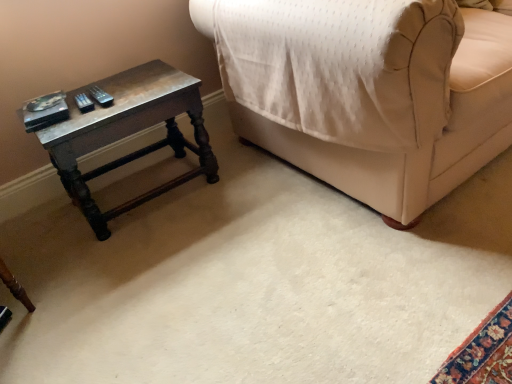
Identify the location of wooden table at left. This screenshot has width=512, height=384. (128, 133).

This screenshot has width=512, height=384. Describe the element at coordinates (128, 133) in the screenshot. I see `wooden table at left` at that location.

This screenshot has width=512, height=384. I want to click on beige fabric couch at upper right, so click(422, 144).

This screenshot has width=512, height=384. What do you see at coordinates (422, 144) in the screenshot? I see `beige fabric couch at upper right` at bounding box center [422, 144].

You are a GUI agent. You are given a task and a screenshot of the screen. Output one action in this format:
    pyautogui.click(x=<x>, y=<y>)
    Task: Click on the wooden table at left
    
    Given the screenshot: What is the action you would take?
    pyautogui.click(x=128, y=133)

Based on the photo, is beige fabric couch at upper right to the right of wooden table at left from the viewer's perspective?

Indeed, beige fabric couch at upper right is positioned on the right side of wooden table at left.

Is beige fabric couch at upper right in front of wooden table at left?

Yes, the depth of beige fabric couch at upper right is less than that of wooden table at left.

Considering the positions of points (459, 166) and (170, 180), is point (459, 166) closer to camera compared to point (170, 180)?

Yes.

From the image's perspective, is beige fabric couch at upper right above or below wooden table at left?

From the image's perspective, beige fabric couch at upper right appears above wooden table at left.

From a real-world perspective, which object stands above the other?

From a 3D spatial view, beige fabric couch at upper right is above.

Considering the sizes of beige fabric couch at upper right and wooden table at left in the image, is beige fabric couch at upper right wider or thinner than wooden table at left?

In the image, beige fabric couch at upper right appears to be wider than wooden table at left.

Who is shorter, beige fabric couch at upper right or wooden table at left?

With less height is wooden table at left.

Which of these two, beige fabric couch at upper right or wooden table at left, is smaller?

wooden table at left.

Is beige fabric couch at upper right not within wooden table at left?

Indeed, beige fabric couch at upper right is completely outside wooden table at left.

Are beige fabric couch at upper right and wooden table at left located far from each other?

beige fabric couch at upper right is actually quite close to wooden table at left.

Is wooden table at left at the back of beige fabric couch at upper right?

That's not correct — beige fabric couch at upper right is not looking away from wooden table at left.

This screenshot has width=512, height=384. I want to click on table that appears below the beige fabric couch at upper right (from a real-world perspective), so click(x=128, y=133).

Which object is positioned more to the left, wooden table at left or beige fabric couch at upper right?

wooden table at left.

In the image, is wooden table at left positioned in front of or behind beige fabric couch at upper right?

Clearly, wooden table at left is behind beige fabric couch at upper right.

Does point (98, 233) lie in front of point (278, 133)?

Yes, it is.

From the image's perspective, is wooden table at left located above beige fabric couch at upper right?

No.

From a real-world perspective, who is located lower, wooden table at left or beige fabric couch at upper right?

wooden table at left is physically lower.

Can you confirm if wooden table at left is wider than beige fabric couch at upper right?

No.

In the scene shown: Considering the sizes of wooden table at left and beige fabric couch at upper right in the image, is wooden table at left taller or shorter than beige fabric couch at upper right?

Clearly, wooden table at left is shorter compared to beige fabric couch at upper right.

Looking at this image, is wooden table at left bigger than beige fabric couch at upper right?

Incorrect, wooden table at left is not larger than beige fabric couch at upper right.

Which is correct: wooden table at left is inside beige fabric couch at upper right, or outside of it?

wooden table at left exists outside the volume of beige fabric couch at upper right.

Is wooden table at left far away from beige fabric couch at upper right?

No, wooden table at left is not far away from beige fabric couch at upper right.

Looking at this image, is wooden table at left facing away from beige fabric couch at upper right?

That's not correct — wooden table at left is not looking away from beige fabric couch at upper right.

Can you tell me how much wooden table at left and beige fabric couch at upper right differ in facing direction?

The facing directions of wooden table at left and beige fabric couch at upper right are 2.69 degrees apart.

How distant is wooden table at left from beige fabric couch at upper right?

wooden table at left is 22.68 inches away from beige fabric couch at upper right.

At what (x,y) coordinates should I click in order to perform the action: click on table below the beige fabric couch at upper right (from a real-world perspective). Please return your answer as a coordinate pair (x, y). This screenshot has width=512, height=384. Looking at the image, I should click on (128, 133).

Identify the location of furniture in front of the wooden table at left. The width and height of the screenshot is (512, 384). (422, 144).

The width and height of the screenshot is (512, 384). What are the coordinates of `table located behind the beige fabric couch at upper right` in the screenshot? It's located at (128, 133).